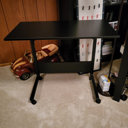
Locate an element on the screen. The height and width of the screenshot is (128, 128). books is located at coordinates (106, 49).